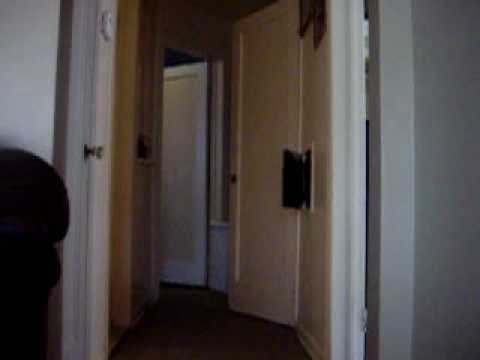
This screenshot has width=480, height=360. Identify the location of door. (431, 216).